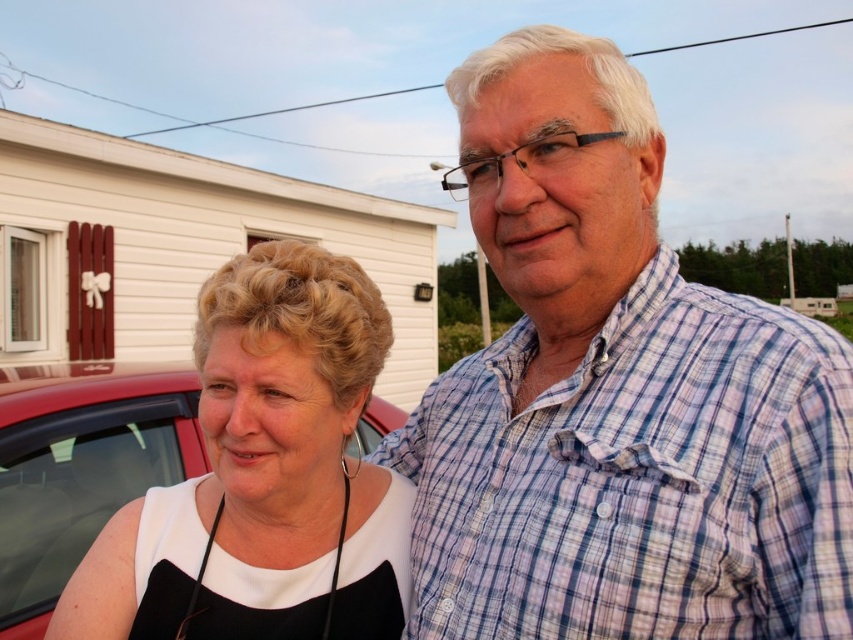
Question: Which point appears farthest from the camera in this image?

Choices:
 (A) (335, 496)
 (B) (775, 480)

Answer: (A)

Question: Which point is closer to the camera?

Choices:
 (A) plaid shirt at right
 (B) white matte dress at center

Answer: (A)

Question: Is plaid shirt at right thinner than white matte dress at center?

Choices:
 (A) yes
 (B) no

Answer: (B)

Question: Which of the following is the farthest from the observer?

Choices:
 (A) plaid shirt at right
 (B) white matte dress at center

Answer: (B)

Question: Where is plaid shirt at right located in relation to white matte dress at center in the image?

Choices:
 (A) right
 (B) left

Answer: (A)

Question: Is plaid shirt at right smaller than white matte dress at center?

Choices:
 (A) no
 (B) yes

Answer: (A)